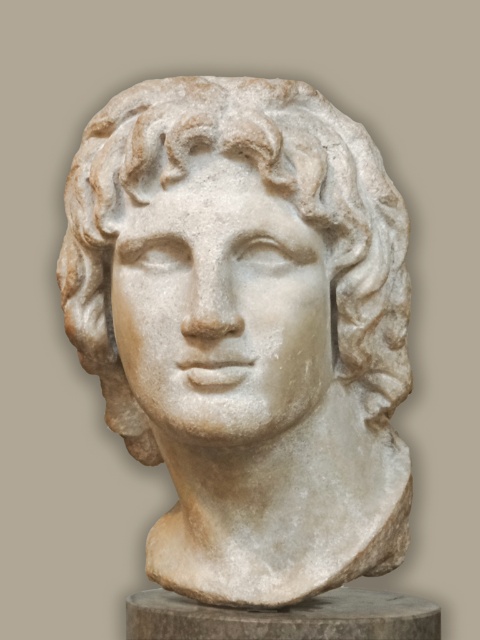
Question: Among these points, which one is farthest from the camera?

Choices:
 (A) (120, 113)
 (B) (136, 621)

Answer: (B)

Question: Is white marble head at center smaller than white marble bust at center?

Choices:
 (A) yes
 (B) no

Answer: (B)

Question: In this image, where is white marble head at center located relative to white marble bust at center?

Choices:
 (A) left
 (B) right

Answer: (A)

Question: Is white marble head at center bigger than white marble bust at center?

Choices:
 (A) no
 (B) yes

Answer: (B)